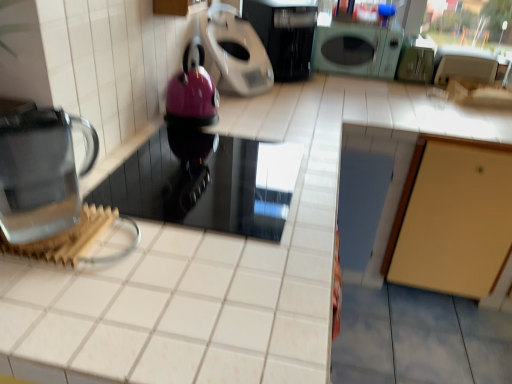
In order to click on vacant area that is in front of black glossy microwave at upper center, arranged as the second kitchen appliance when viewed from the left in this screenshot , I will do `click(306, 95)`.